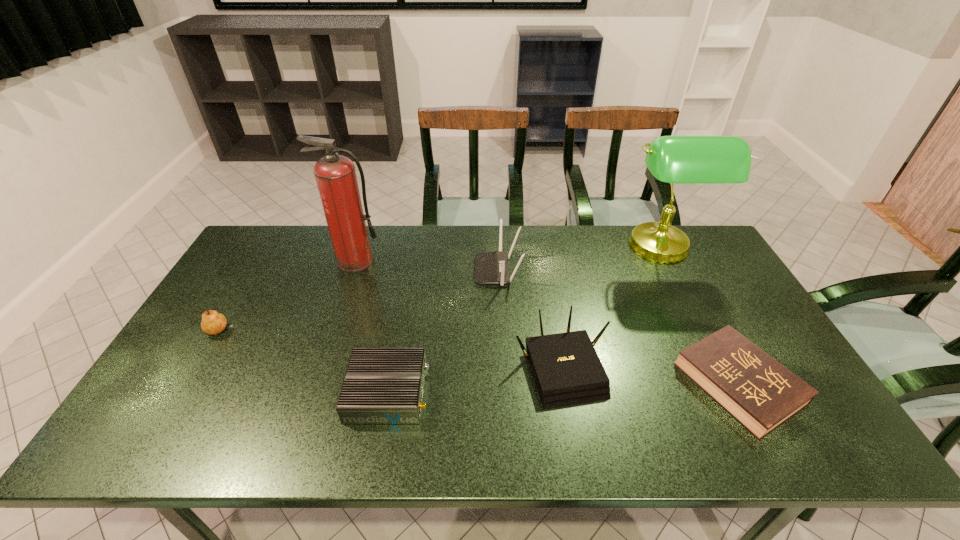
Identify the location of vacant space located on the left of the hardback book. (601, 384).

Find the location of a particular element. fire extinguisher located in the far edge section of the desktop is located at coordinates (335, 175).

Locate an element on the screen. This screenshot has height=540, width=960. lamp that is at the far edge is located at coordinates (672, 159).

Locate an element on the screen. This screenshot has height=540, width=960. router at the far edge is located at coordinates (490, 267).

At what (x,y) coordinates should I click in order to perform the action: click on router located at the near edge. Please return your answer as a coordinate pair (x, y). This screenshot has width=960, height=540. Looking at the image, I should click on click(382, 385).

The height and width of the screenshot is (540, 960). What are the coordinates of `hardback book present at the near edge` in the screenshot? It's located at (761, 394).

At what (x,y) coordinates should I click in order to perform the action: click on object located at the left edge. Please return your answer as a coordinate pair (x, y). Looking at the image, I should click on (212, 323).

At what (x,y) coordinates should I click in order to perform the action: click on lamp that is at the right edge. Please return your answer as a coordinate pair (x, y). Looking at the image, I should click on (672, 159).

At what (x,y) coordinates should I click in order to perform the action: click on hardback book at the right edge. Please return your answer as a coordinate pair (x, y). Looking at the image, I should click on (761, 394).

Find the location of a particular element. This screenshot has width=960, height=540. object that is positioned at the far right corner is located at coordinates (672, 159).